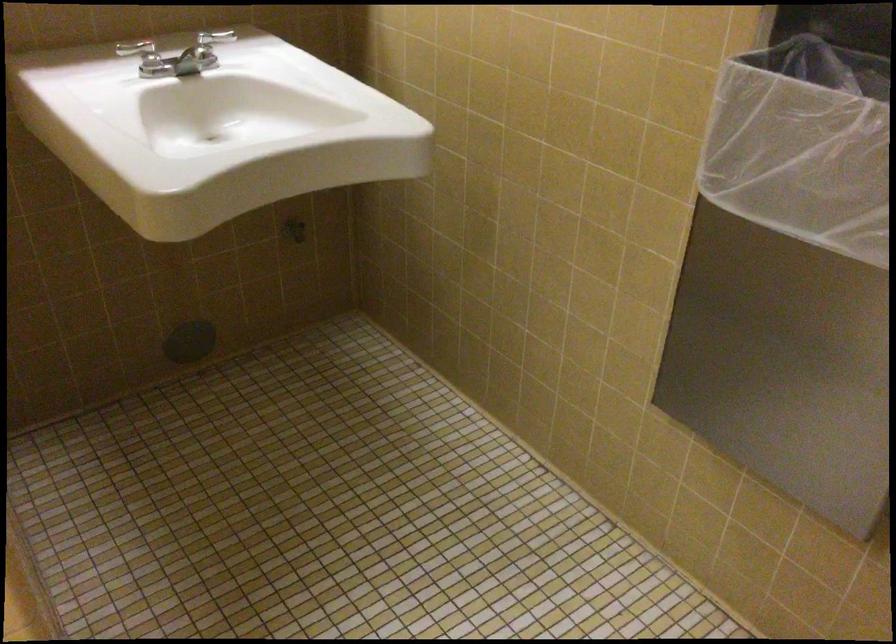
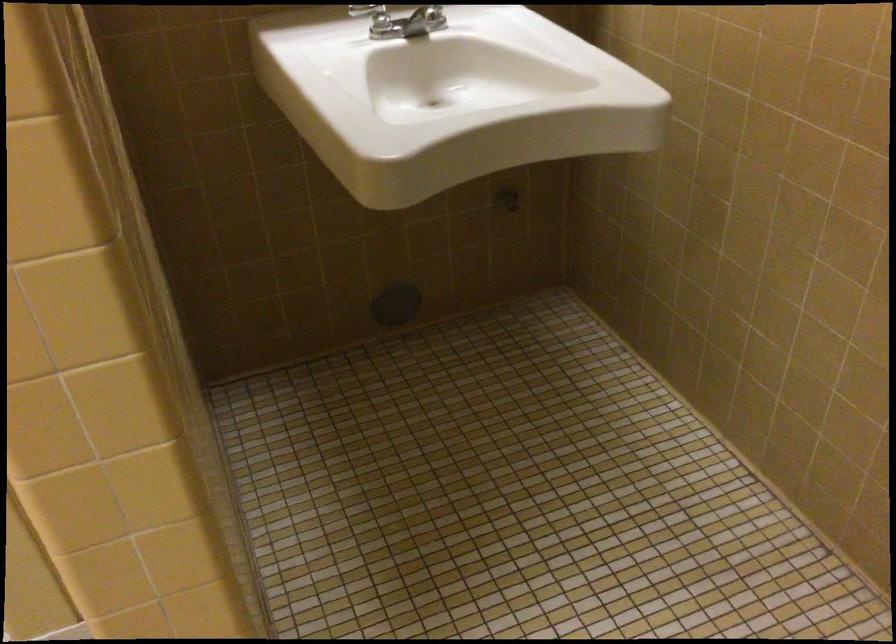
Question: How did the camera likely rotate?

Choices:
 (A) Left
 (B) Right
 (C) Up
 (D) Down

Answer: (A)